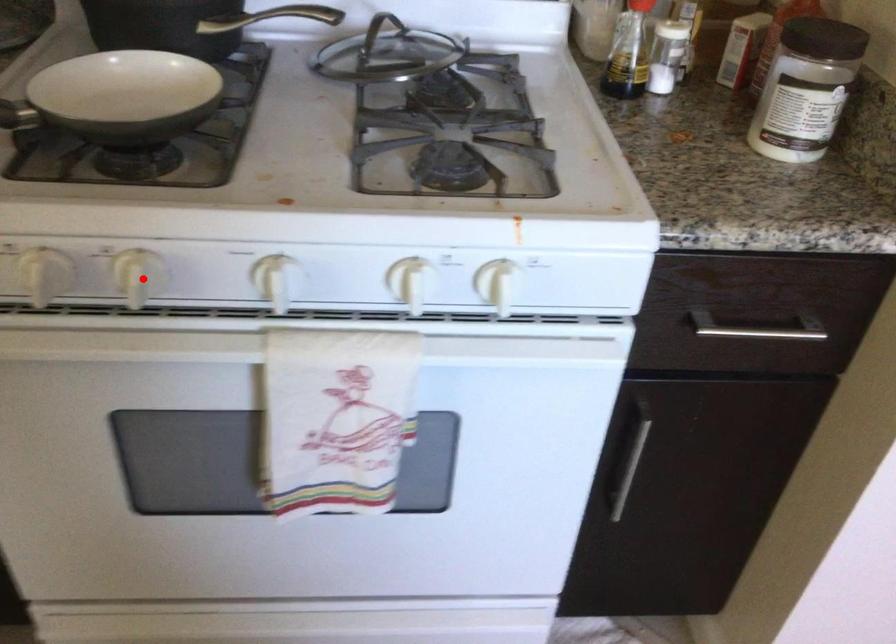
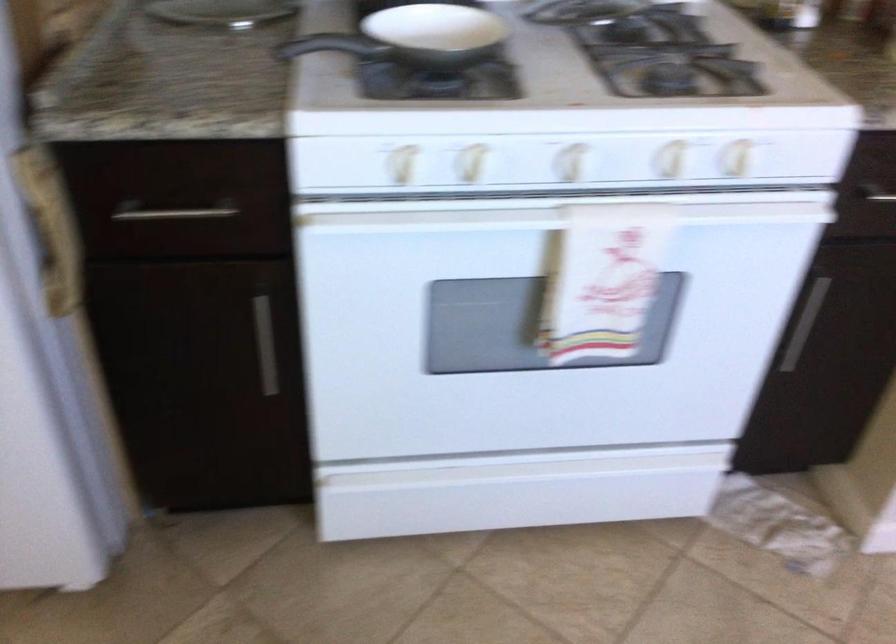
In the second image, find the point that corresponds to the highlighted location in the first image.

(471, 163)